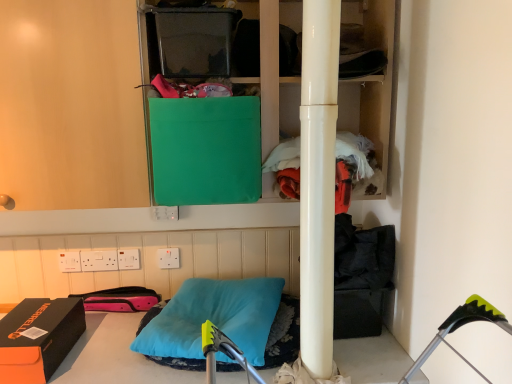
Question: Which direction should I rotate to look at white plastic electric outlet at upper center, which is the third electric outlet from left to right?

Choices:
 (A) left
 (B) right

Answer: (A)

Question: Does teal soft pillow at center have a lesser height compared to white plastic electric outlet at upper center, the 3th electric outlet in the right-to-left sequence?

Choices:
 (A) no
 (B) yes

Answer: (A)

Question: Is teal soft pillow at center next to white plastic electric outlet at upper center, the 3th electric outlet in the right-to-left sequence?

Choices:
 (A) no
 (B) yes

Answer: (A)

Question: From a real-world perspective, is teal soft pillow at center positioned over white plastic electric outlet at upper center, the 3th electric outlet in the right-to-left sequence, based on gravity?

Choices:
 (A) yes
 (B) no

Answer: (B)

Question: Is teal soft pillow at center to the right of white plastic electric outlet at upper center, the 3th electric outlet in the right-to-left sequence, from the viewer's perspective?

Choices:
 (A) no
 (B) yes

Answer: (B)

Question: Can you confirm if teal soft pillow at center is thinner than white plastic electric outlet at upper center, which is the third electric outlet from left to right?

Choices:
 (A) no
 (B) yes

Answer: (A)

Question: Would you say teal soft pillow at center is outside white plastic electric outlet at upper center, the 3th electric outlet in the right-to-left sequence?

Choices:
 (A) yes
 (B) no

Answer: (A)

Question: From a real-world perspective, is white plastic electric outlet at lower center, which is the 5th electric outlet in left-to-right order, under transparent plastic container at upper center, which is the third box from bottom to top?

Choices:
 (A) yes
 (B) no

Answer: (A)

Question: Does white plastic electric outlet at lower center, placed as the 1th electric outlet when sorted from right to left, contain transparent plastic container at upper center, placed as the second box when sorted from right to left?

Choices:
 (A) no
 (B) yes

Answer: (A)

Question: Considering the relative positions of white plastic electric outlet at lower center, placed as the 1th electric outlet when sorted from right to left, and transparent plastic container at upper center, placed as the second box when sorted from right to left, in the image provided, is white plastic electric outlet at lower center, placed as the 1th electric outlet when sorted from right to left, to the left of transparent plastic container at upper center, placed as the second box when sorted from right to left, from the viewer's perspective?

Choices:
 (A) no
 (B) yes

Answer: (B)

Question: Is white plastic electric outlet at lower center, placed as the 1th electric outlet when sorted from right to left, positioned with its back to transparent plastic container at upper center, the 1th box from the top?

Choices:
 (A) yes
 (B) no

Answer: (B)

Question: Is white plastic electric outlet at lower center, which is the 5th electric outlet in left-to-right order, not close to transparent plastic container at upper center, placed as the second box when sorted from right to left?

Choices:
 (A) yes
 (B) no

Answer: (B)

Question: From the image's perspective, is white plastic electric outlet at lower center, which is the 5th electric outlet in left-to-right order, above transparent plastic container at upper center, placed as the second box when sorted from right to left?

Choices:
 (A) yes
 (B) no

Answer: (B)

Question: Is glossy white pole at center in front of white plastic electric outlet at upper center, the 3th electric outlet in the right-to-left sequence?

Choices:
 (A) no
 (B) yes

Answer: (B)